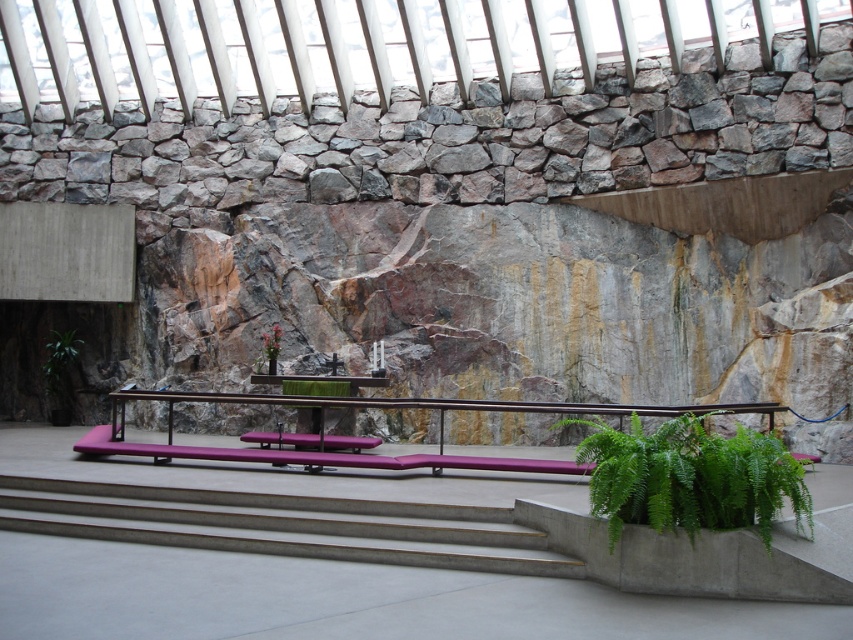
Question: Can you confirm if green leafy plant at lower left is positioned to the left of green leafy plant at center?

Choices:
 (A) no
 (B) yes

Answer: (B)

Question: Estimate the real-world distances between objects in this image. Which object is closer to the green leafy plant at center?

Choices:
 (A) green leafy plant at lower left
 (B) green leafy plant at lower right

Answer: (A)

Question: Does green leafy plant at lower right have a smaller size compared to green leafy plant at lower left?

Choices:
 (A) yes
 (B) no

Answer: (B)

Question: Which is nearer to the green leafy plant at lower right?

Choices:
 (A) green leafy plant at center
 (B) green leafy plant at lower left

Answer: (A)

Question: Which of the following is the farthest from the observer?

Choices:
 (A) green leafy plant at lower right
 (B) green leafy plant at lower left
 (C) green leafy plant at center

Answer: (B)

Question: Is green leafy plant at lower left to the right of green leafy plant at center from the viewer's perspective?

Choices:
 (A) no
 (B) yes

Answer: (A)